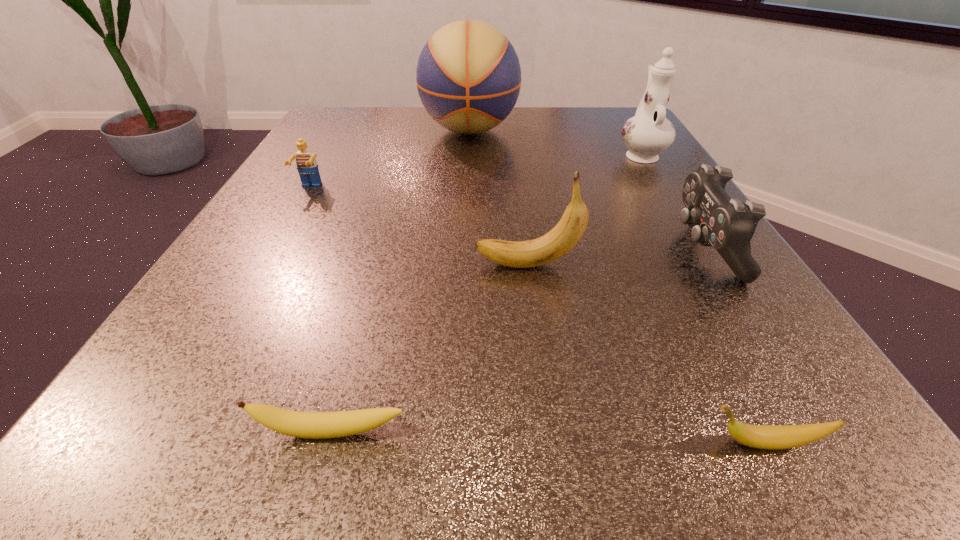
What are the coordinates of `vacant space located at the stem of the rightmost banana` in the screenshot? It's located at (453, 443).

I want to click on vacant space located at the stem of the rightmost banana, so click(x=383, y=443).

At what (x,y) coordinates should I click in order to perform the action: click on vacant region located at the stem of the rightmost banana. Please return your answer as a coordinate pair (x, y). Looking at the image, I should click on (393, 443).

Locate an element on the screen. basketball that is at the far edge is located at coordinates (468, 76).

Identify the location of chinaware that is at the far edge. (648, 133).

You are a GUI agent. You are given a task and a screenshot of the screen. Output one action in this format:
    pyautogui.click(x=<x>, y=<y>)
    Task: Click on the Lego that is at the left edge
    The width and height of the screenshot is (960, 540).
    Given the screenshot: What is the action you would take?
    pyautogui.click(x=307, y=166)

Locate an element on the screen. The height and width of the screenshot is (540, 960). banana that is at the left edge is located at coordinates (314, 425).

Identify the location of chinaware that is positioned at the right edge. The height and width of the screenshot is (540, 960). (648, 133).

Where is `control at the right edge`? The width and height of the screenshot is (960, 540). control at the right edge is located at coordinates (728, 225).

Locate an element on the screen. banana located in the right edge section of the desktop is located at coordinates (773, 437).